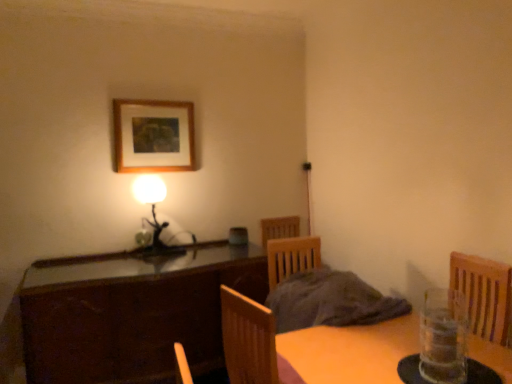
Question: Considering the relative sizes of clear glass vase at lower right and matte black lamp at left in the image provided, is clear glass vase at lower right shorter than matte black lamp at left?

Choices:
 (A) no
 (B) yes

Answer: (B)

Question: From the image's perspective, does clear glass vase at lower right appear lower than matte black lamp at left?

Choices:
 (A) yes
 (B) no

Answer: (A)

Question: Is clear glass vase at lower right smaller than matte black lamp at left?

Choices:
 (A) yes
 (B) no

Answer: (A)

Question: Can you confirm if clear glass vase at lower right is positioned to the right of matte black lamp at left?

Choices:
 (A) yes
 (B) no

Answer: (A)

Question: From a real-world perspective, is clear glass vase at lower right physically above matte black lamp at left?

Choices:
 (A) yes
 (B) no

Answer: (B)

Question: From a real-world perspective, relative to wooden picture frame at upper center, is matte black lamp at left vertically above or below?

Choices:
 (A) below
 (B) above

Answer: (A)

Question: Is point (157, 180) closer or farther from the camera than point (117, 125)?

Choices:
 (A) closer
 (B) farther

Answer: (B)

Question: From the image's perspective, relative to wooden picture frame at upper center, is matte black lamp at left above or below?

Choices:
 (A) below
 (B) above

Answer: (A)

Question: From their relative heights in the image, would you say matte black lamp at left is taller or shorter than wooden picture frame at upper center?

Choices:
 (A) tall
 (B) short

Answer: (A)

Question: From the image's perspective, relative to wooden picture frame at upper center, is dark wood cabinet at center above or below?

Choices:
 (A) below
 (B) above

Answer: (A)

Question: Is dark wood cabinet at center in front of or behind wooden picture frame at upper center in the image?

Choices:
 (A) behind
 (B) front

Answer: (B)

Question: Considering the positions of dark wood cabinet at center and wooden picture frame at upper center in the image, is dark wood cabinet at center bigger or smaller than wooden picture frame at upper center?

Choices:
 (A) small
 (B) big

Answer: (B)

Question: Looking at their shapes, would you say dark wood cabinet at center is wider or thinner than wooden picture frame at upper center?

Choices:
 (A) thin
 (B) wide

Answer: (B)

Question: In terms of size, does wooden picture frame at upper center appear bigger or smaller than dark wood cabinet at center?

Choices:
 (A) small
 (B) big

Answer: (A)

Question: Looking at their shapes, would you say wooden picture frame at upper center is wider or thinner than dark wood cabinet at center?

Choices:
 (A) wide
 (B) thin

Answer: (B)